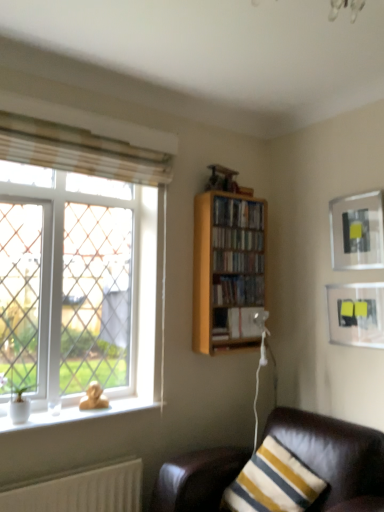
Question: Considering their positions, is hardcover book at center, the fifth book viewed from the top, located in front of or behind wooden bookcase at upper right?

Choices:
 (A) behind
 (B) front

Answer: (A)

Question: Considering the positions of hardcover book at center, the fifth book viewed from the top, and wooden bookcase at upper right in the image, is hardcover book at center, the fifth book viewed from the top, taller or shorter than wooden bookcase at upper right?

Choices:
 (A) tall
 (B) short

Answer: (B)

Question: Considering the real-world distances, which object is farthest from the beige fabric curtain at upper left?

Choices:
 (A) wooden bookshelf at center, which is the fourth book in bottom-to-top order
 (B) hardcover book at center, the fifth book viewed from the top
 (C) wooden bookshelf at upper right, the 3th book from the bottom
 (D) wooden bookshelf at upper right, marked as the first book in a top-to-bottom arrangement
 (E) hardcover books at center, placed as the second book when sorted from bottom to top

Answer: (B)

Question: Which of these objects is positioned farthest from the matte black picture frame at upper right, acting as the second picture frame starting from the bottom?

Choices:
 (A) wooden bookshelf at upper right, the 3th book from the bottom
 (B) beige fabric curtain at upper left
 (C) wooden bookshelf at upper right, placed as the 5th book when sorted from bottom to top
 (D) hardcover book at center, the fifth book viewed from the top
 (E) wooden bookcase at upper right

Answer: (B)